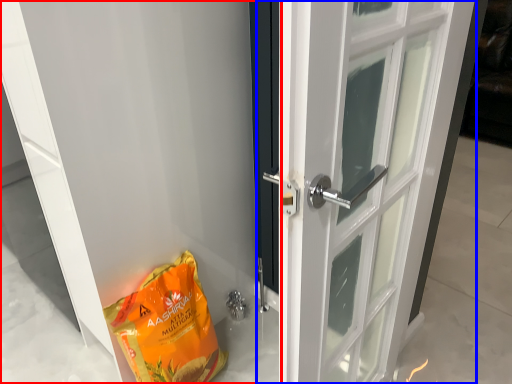
Question: Among these objects, which one is farthest to the camera, door (highlighted by a red box) or door (highlighted by a blue box)?

Choices:
 (A) door
 (B) door

Answer: (B)